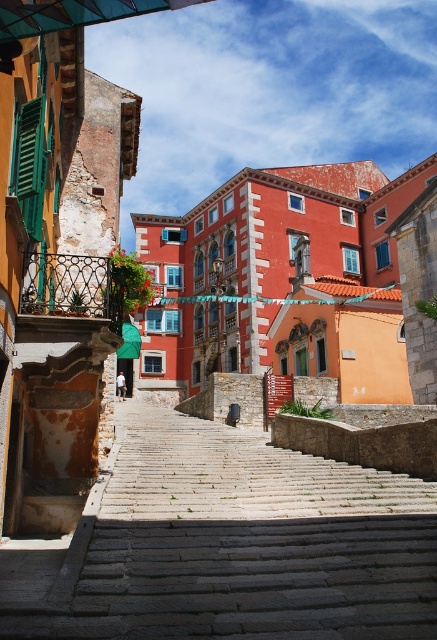
You are standing at the bottom of the stone steps in the historic town scene. You notice two points marked in the image. Which point, point (20, 294) or point (27, 196), is closer to you as you face the steps?

Point (20, 294) is closer to you because it is further to the viewer than point (27, 196).

You are standing at the bottom of the stone steps in the historic town. You see a point marked at coordinates (70, 289). Which object does this point correspond to?

The point at (70, 289) corresponds to the black wrought iron balustrade at left.